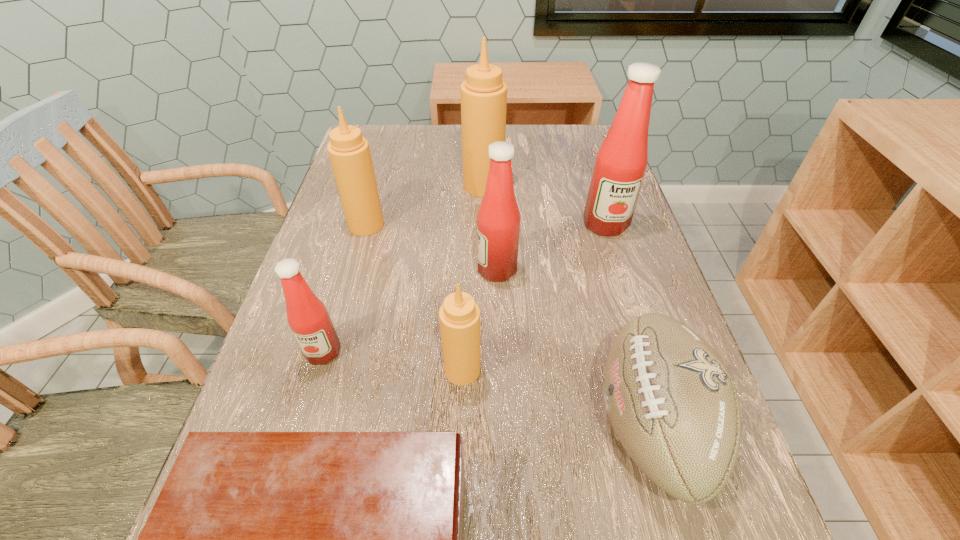
Locate an element on the screen. The image size is (960, 540). vacant space that satisfies the following two spatial constraints: 1. on the front-facing side of the fourth farthest condiment; 2. on the front-facing side of the smallest red condiment is located at coordinates (500, 352).

I want to click on blank area in the image that satisfies the following two spatial constraints: 1. on the front-facing side of the nearest tan condiment; 2. on the left side of the nearest red condiment, so click(x=318, y=370).